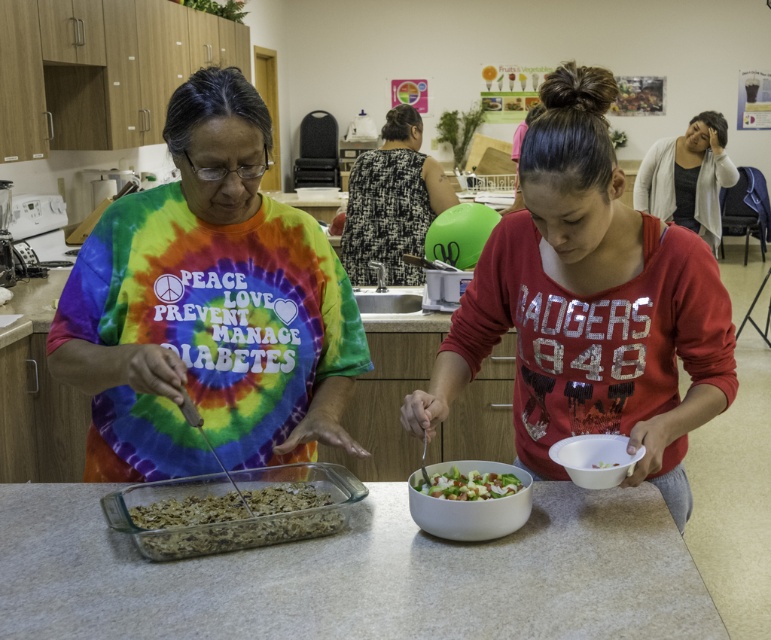
Does black textured dress at center appear on the right side of white plastic bowl at lower right?

No, black textured dress at center is not to the right of white plastic bowl at lower right.

Can you confirm if black textured dress at center is positioned to the left of white plastic bowl at lower right?

Correct, you'll find black textured dress at center to the left of white plastic bowl at lower right.

Which is behind, point (386, 198) or point (604, 467)?

The point (386, 198) is behind.

The image size is (771, 640). Identify the location of black textured dress at center. (392, 202).

Does black textured dress at center appear under white glossy bowl at center?

No.

Can you confirm if black textured dress at center is bigger than white glossy bowl at center?

Yes.

The height and width of the screenshot is (640, 771). What do you see at coordinates (392, 202) in the screenshot?
I see `black textured dress at center` at bounding box center [392, 202].

Find the location of `black textured dress at center`. black textured dress at center is located at coordinates (392, 202).

Can you confirm if matte red shirt at center is positioned to the right of white matte bowl at center?

Yes, matte red shirt at center is to the right of white matte bowl at center.

Is matte red shirt at center positioned behind white matte bowl at center?

That is False.

Is point (662, 356) positioned behind point (465, 500)?

Yes, it is behind point (465, 500).

At what (x,y) coordinates should I click in order to perform the action: click on matte red shirt at center. Please return your answer as a coordinate pair (x, y). This screenshot has height=640, width=771. Looking at the image, I should click on (591, 305).